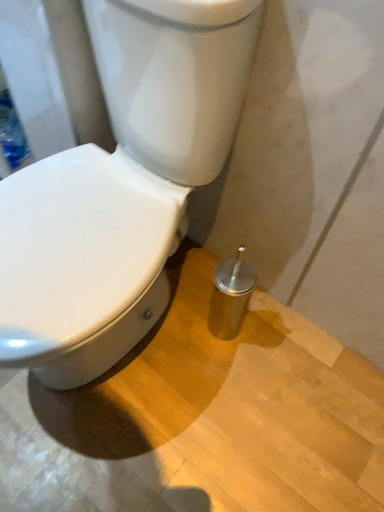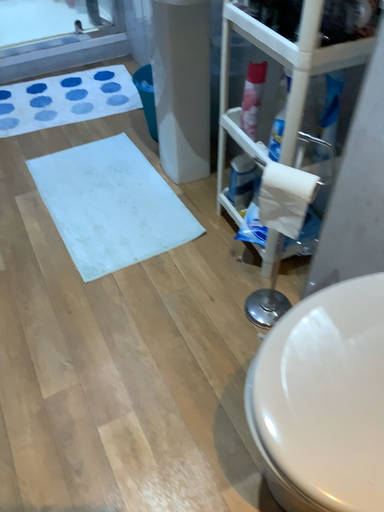
Question: How did the camera likely rotate when shooting the video?

Choices:
 (A) rotated downward
 (B) rotated upward

Answer: (B)